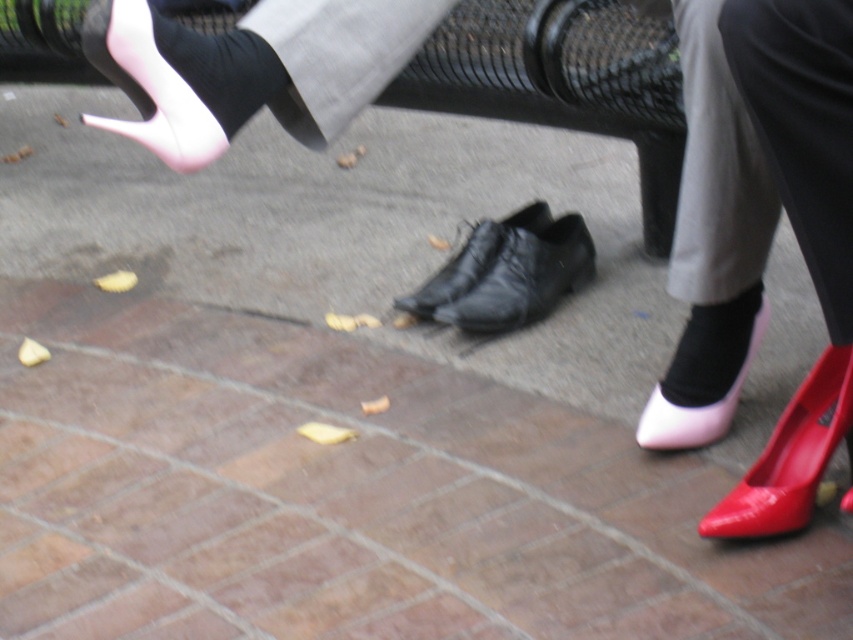
Question: Does matte pink high-heeled shoe at upper left have a greater width compared to black leather boot at center?

Choices:
 (A) no
 (B) yes

Answer: (A)

Question: Is black smooth sock at lower right positioned before black leather boot at center?

Choices:
 (A) yes
 (B) no

Answer: (A)

Question: Which of the following is the farthest from the observer?

Choices:
 (A) black leather boot at center
 (B) black smooth sock at lower right
 (C) glossy patent shoe at lower right
 (D) matte pink high-heeled shoe at upper left

Answer: (A)

Question: Which point is farther to the camera?

Choices:
 (A) glossy patent shoe at lower right
 (B) black smooth sock at lower right
 (C) black leather boot at center
 (D) matte pink high-heeled shoe at upper left

Answer: (C)

Question: Does glossy patent shoe at lower right have a smaller size compared to matte pink high-heeled shoe at upper left?

Choices:
 (A) no
 (B) yes

Answer: (A)

Question: Considering the real-world distances, which object is farthest from the black leather boot at center?

Choices:
 (A) matte pink high-heeled shoe at upper left
 (B) glossy patent shoe at lower right

Answer: (A)